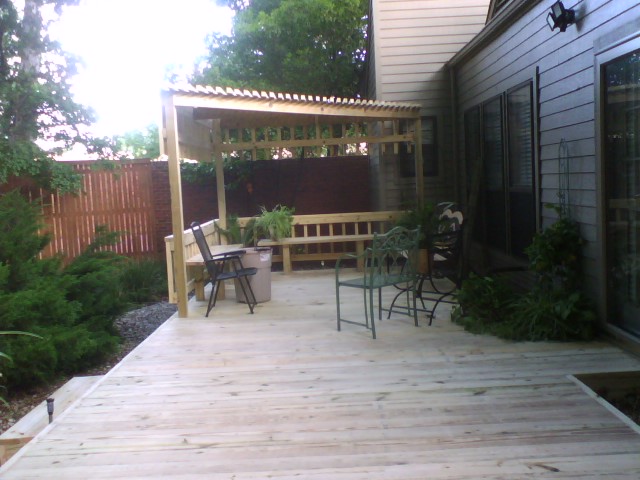
Locate an element on the screen. The image size is (640, 480). green metallic chair is located at coordinates (371, 283).